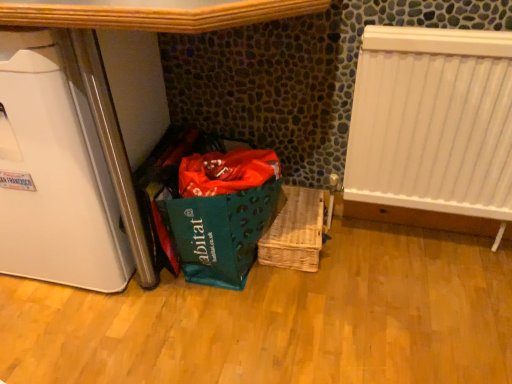
What are the coordinates of `free region under white plastic radiator at right (from a real-world perspective)` in the screenshot? It's located at (412, 236).